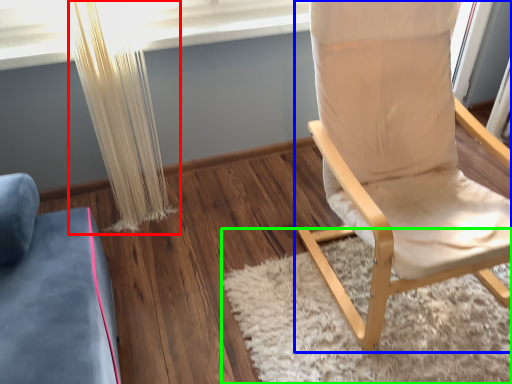
Question: Which object is positioned farthest from curtain (highlighted by a red box)? Select from chair (highlighted by a blue box) and mat (highlighted by a green box).

Choices:
 (A) chair
 (B) mat

Answer: (A)